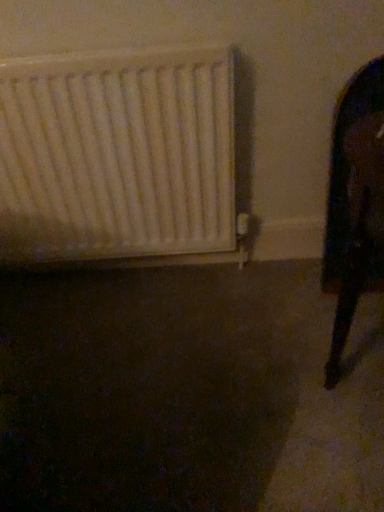
Question: Should I look upward or downward to see white matte radiator at left?

Choices:
 (A) up
 (B) down

Answer: (A)

Question: Can you confirm if black glossy mirror at right is bigger than white matte radiator at left?

Choices:
 (A) yes
 (B) no

Answer: (B)

Question: Is black glossy mirror at right shorter than white matte radiator at left?

Choices:
 (A) no
 (B) yes

Answer: (A)

Question: Is black glossy mirror at right to the left of white matte radiator at left from the viewer's perspective?

Choices:
 (A) yes
 (B) no

Answer: (B)

Question: From the image's perspective, does black glossy mirror at right appear higher than white matte radiator at left?

Choices:
 (A) no
 (B) yes

Answer: (A)

Question: From a real-world perspective, is black glossy mirror at right positioned under white matte radiator at left based on gravity?

Choices:
 (A) no
 (B) yes

Answer: (B)

Question: Is black glossy mirror at right thinner than white matte radiator at left?

Choices:
 (A) no
 (B) yes

Answer: (A)

Question: Is white matte radiator at left beside black glossy mirror at right?

Choices:
 (A) no
 (B) yes

Answer: (A)

Question: Is white matte radiator at left at the right side of black glossy mirror at right?

Choices:
 (A) yes
 (B) no

Answer: (B)

Question: Can you confirm if white matte radiator at left is smaller than black glossy mirror at right?

Choices:
 (A) no
 (B) yes

Answer: (A)

Question: Does white matte radiator at left have a greater width compared to black glossy mirror at right?

Choices:
 (A) no
 (B) yes

Answer: (A)

Question: From a real-world perspective, is white matte radiator at left below black glossy mirror at right?

Choices:
 (A) yes
 (B) no

Answer: (B)

Question: From a real-world perspective, is white matte radiator at left physically above black glossy mirror at right?

Choices:
 (A) yes
 (B) no

Answer: (A)

Question: Looking at the image, does black glossy mirror at right seem bigger or smaller compared to white matte radiator at left?

Choices:
 (A) small
 (B) big

Answer: (A)